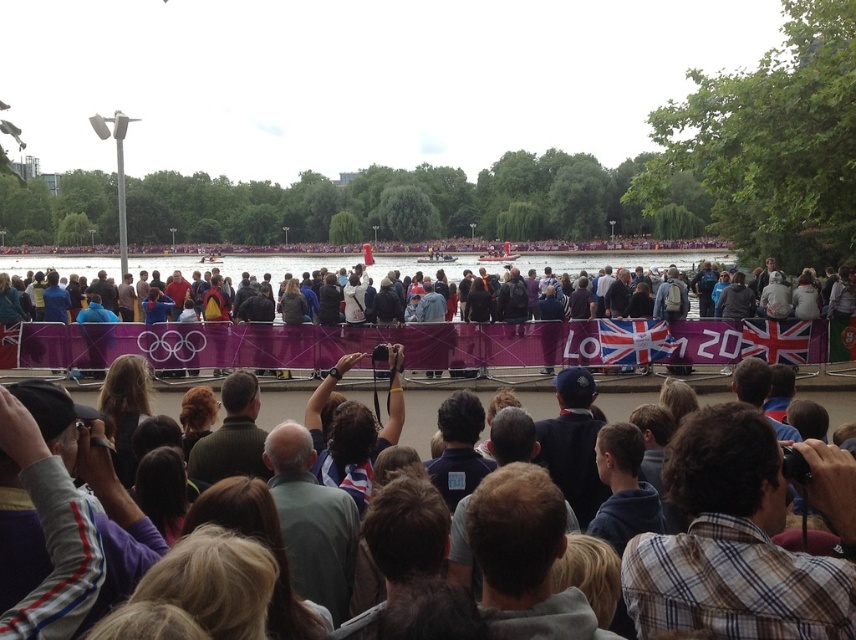
Question: Which of the following is the farthest from the observer?

Choices:
 (A) blue fabric jacket at left
 (B) striped shirt at center
 (C) green fabric shirt at center

Answer: (A)

Question: Based on their relative distances, which object is nearer to the gray fleece jacket at lower left?

Choices:
 (A) green fabric shirt at center
 (B) blue fleece jacket at center
 (C) plaid fabric binoculars at center

Answer: (A)

Question: Is dark gray jacket at center thinner than light brown hair at center?

Choices:
 (A) yes
 (B) no

Answer: (B)

Question: Is plaid fabric binoculars at center below dark gray jacket at center?

Choices:
 (A) no
 (B) yes

Answer: (B)

Question: Is plaid fabric binoculars at center wider than brown hair at center?

Choices:
 (A) yes
 (B) no

Answer: (A)

Question: Which object is farther from the camera taking this photo?

Choices:
 (A) gray fleece jacket at lower left
 (B) blue fabric jacket at left
 (C) brown hair at center

Answer: (B)